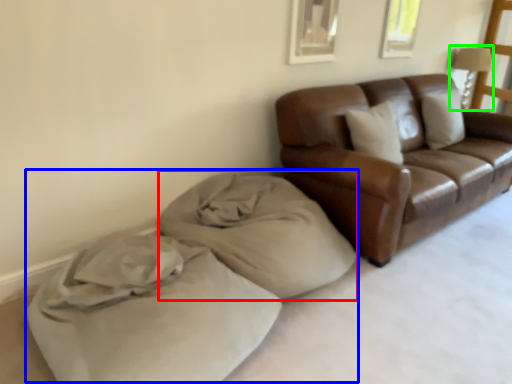
Question: Which object is positioned farthest from material (highlighted by a red box)? Select from bed (highlighted by a blue box) and lamp (highlighted by a green box).

Choices:
 (A) bed
 (B) lamp

Answer: (B)